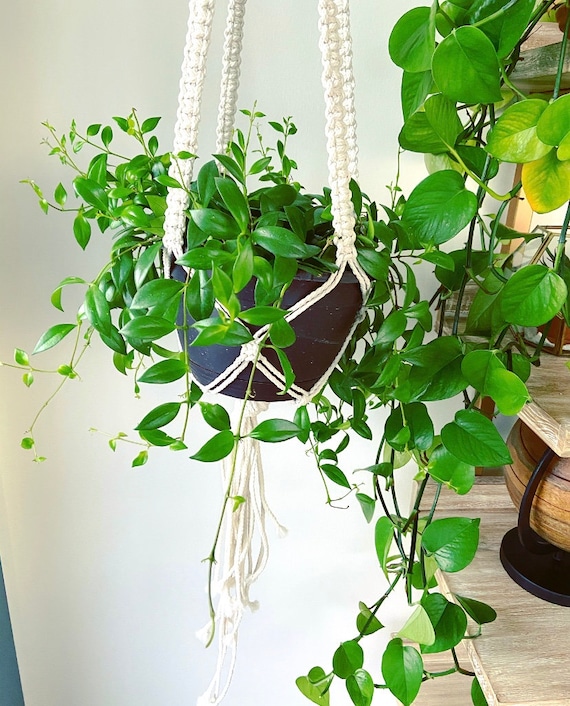
Identify the location of wall. (80, 532).